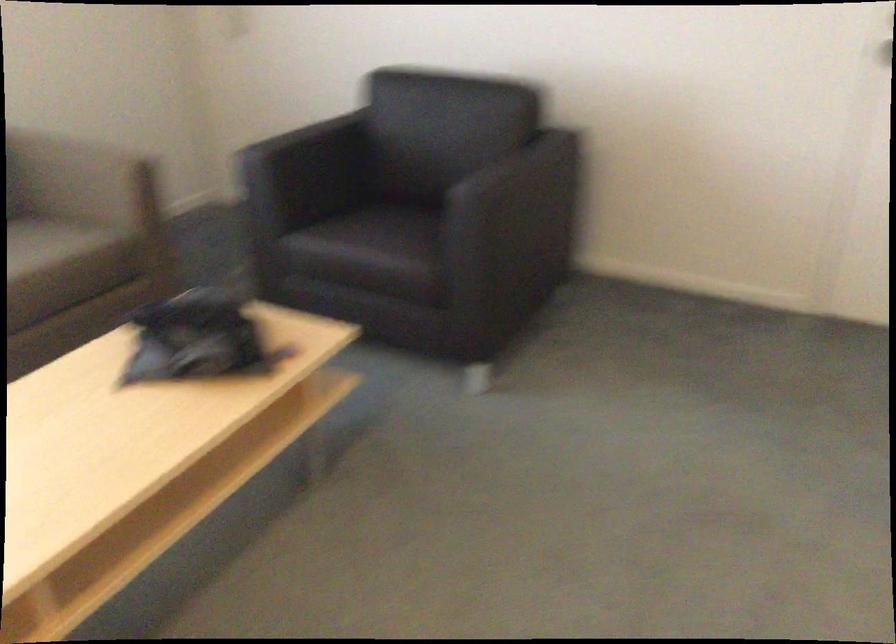
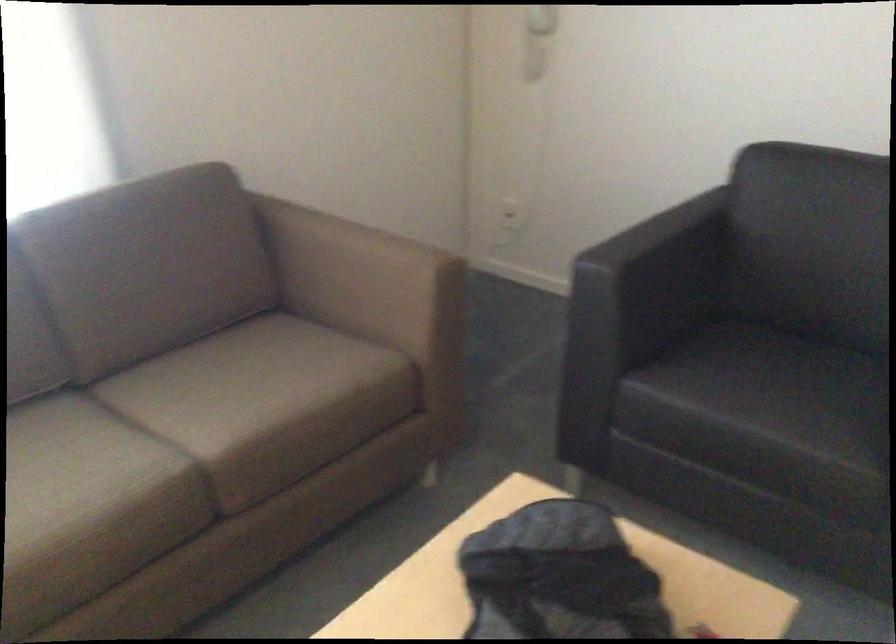
Where in the second image is the point corresponding to (x=79, y=180) from the first image?

(363, 277)